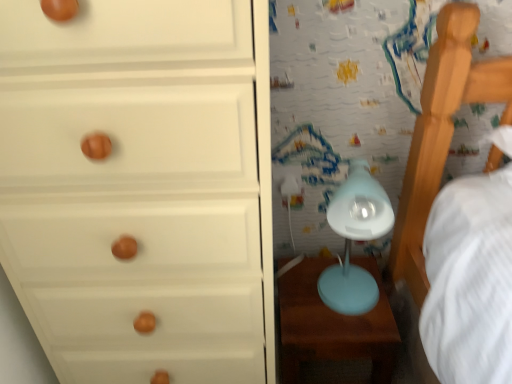
Question: Does white matte chest of drawers at left have a greater width compared to matte blue table at lower right?

Choices:
 (A) no
 (B) yes

Answer: (B)

Question: Is white matte chest of drawers at left behind matte blue table at lower right?

Choices:
 (A) yes
 (B) no

Answer: (B)

Question: Is matte blue table at lower right surrounded by white matte chest of drawers at left?

Choices:
 (A) yes
 (B) no

Answer: (B)

Question: Is white matte chest of drawers at left looking in the opposite direction of matte blue table at lower right?

Choices:
 (A) no
 (B) yes

Answer: (A)

Question: From a real-world perspective, is white matte chest of drawers at left beneath matte blue table at lower right?

Choices:
 (A) no
 (B) yes

Answer: (A)

Question: Is white matte chest of drawers at left taller or shorter than matte blue table at lower right?

Choices:
 (A) tall
 (B) short

Answer: (A)

Question: From the image's perspective, is white matte chest of drawers at left positioned above or below matte blue table at lower right?

Choices:
 (A) below
 (B) above

Answer: (B)

Question: Would you say white matte chest of drawers at left is to the left or to the right of matte blue table at lower right in the picture?

Choices:
 (A) left
 (B) right

Answer: (A)

Question: Based on their sizes in the image, would you say white matte chest of drawers at left is bigger or smaller than matte blue table at lower right?

Choices:
 (A) small
 (B) big

Answer: (B)

Question: Looking at the image, does matte blue table lamp at center-right seem bigger or smaller compared to white matte chest of drawers at left?

Choices:
 (A) big
 (B) small

Answer: (B)

Question: Would you say matte blue table lamp at center-right is inside or outside white matte chest of drawers at left?

Choices:
 (A) outside
 (B) inside

Answer: (A)

Question: From the image's perspective, is matte blue table lamp at center-right above or below white matte chest of drawers at left?

Choices:
 (A) above
 (B) below

Answer: (A)

Question: From a real-world perspective, relative to white matte chest of drawers at left, is matte blue table lamp at center-right vertically above or below?

Choices:
 (A) above
 (B) below

Answer: (B)

Question: Considering the positions of matte blue table at lower right and matte blue table lamp at center-right in the image, is matte blue table at lower right bigger or smaller than matte blue table lamp at center-right?

Choices:
 (A) small
 (B) big

Answer: (B)

Question: Looking at their shapes, would you say matte blue table at lower right is wider or thinner than matte blue table lamp at center-right?

Choices:
 (A) wide
 (B) thin

Answer: (A)